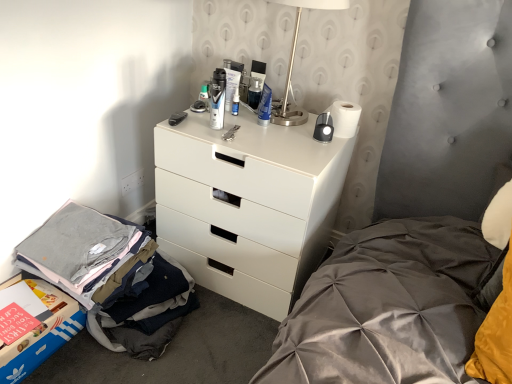
Identify the location of free space to the back side of matte black shaving cream can at center, marked as the second toiletry in a left-to-right arrangement. (219, 117).